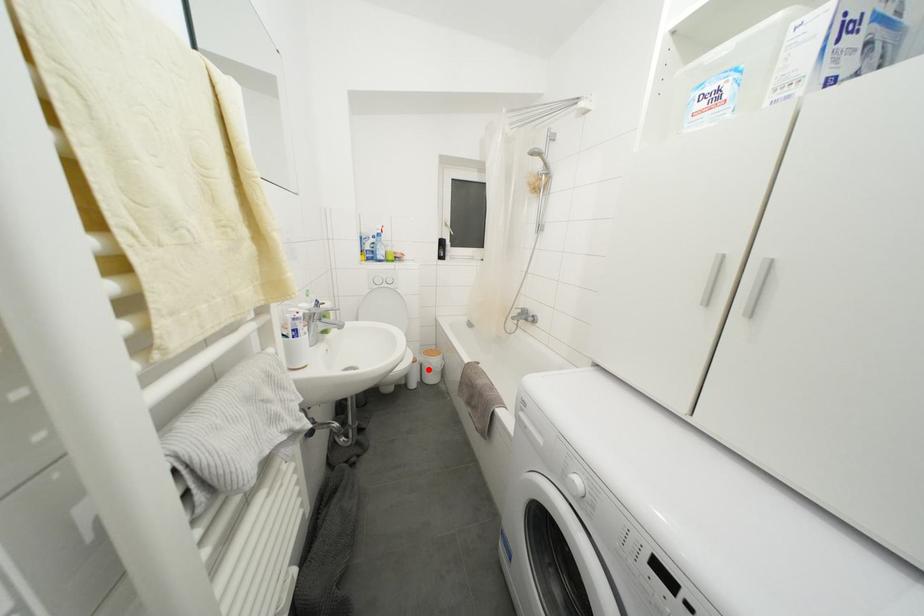
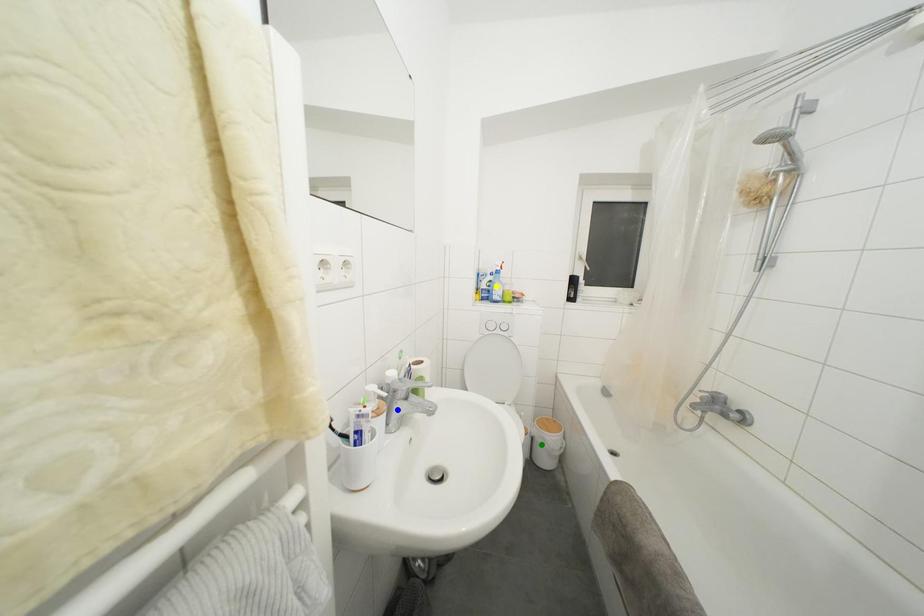
Question: I am providing you with two images of the same scene from different viewpoints. A red point is marked on the first image. You are given multiple points on the second image. Can you choose the point in image 2 that corresponds to the point in image 1?

Choices:
 (A) blue point
 (B) yellow point
 (C) green point

Answer: (C)